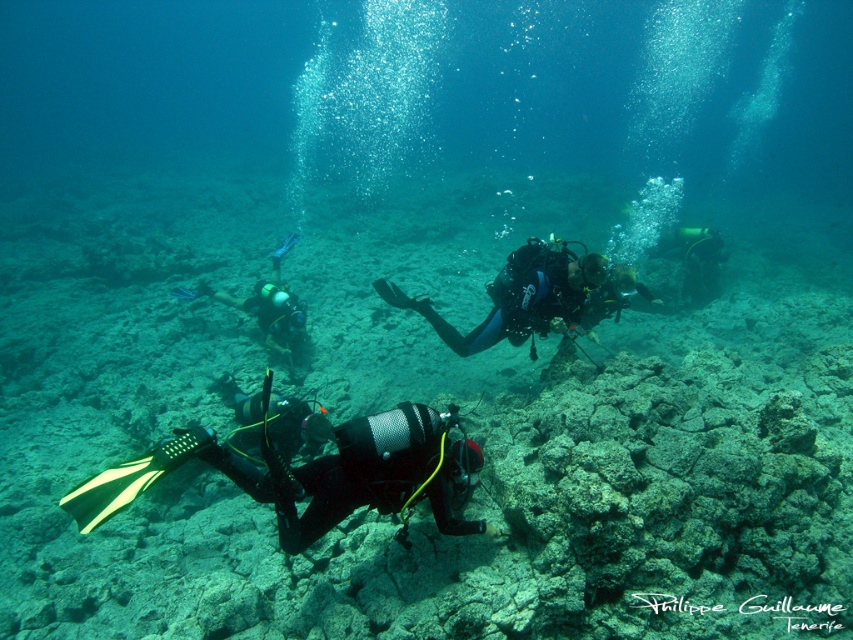
Question: Considering the real-world distances, which object is farthest from the matte black wetsuit at center?

Choices:
 (A) black mesh wetsuit at center
 (B) blue matte scuba diver at center

Answer: (A)

Question: Is black mesh wetsuit at center above blue matte scuba diver at center?

Choices:
 (A) no
 (B) yes

Answer: (A)

Question: Which object is positioned farthest from the black mesh wetsuit at center?

Choices:
 (A) blue matte scuba diver at center
 (B) matte black wetsuit at center

Answer: (B)

Question: Which object is closer to the camera taking this photo?

Choices:
 (A) blue matte scuba diver at center
 (B) matte black wetsuit at center

Answer: (A)

Question: Does black mesh wetsuit at center appear over matte black wetsuit at center?

Choices:
 (A) no
 (B) yes

Answer: (A)

Question: Can you confirm if black mesh wetsuit at center is positioned above blue matte scuba diver at center?

Choices:
 (A) yes
 (B) no

Answer: (B)